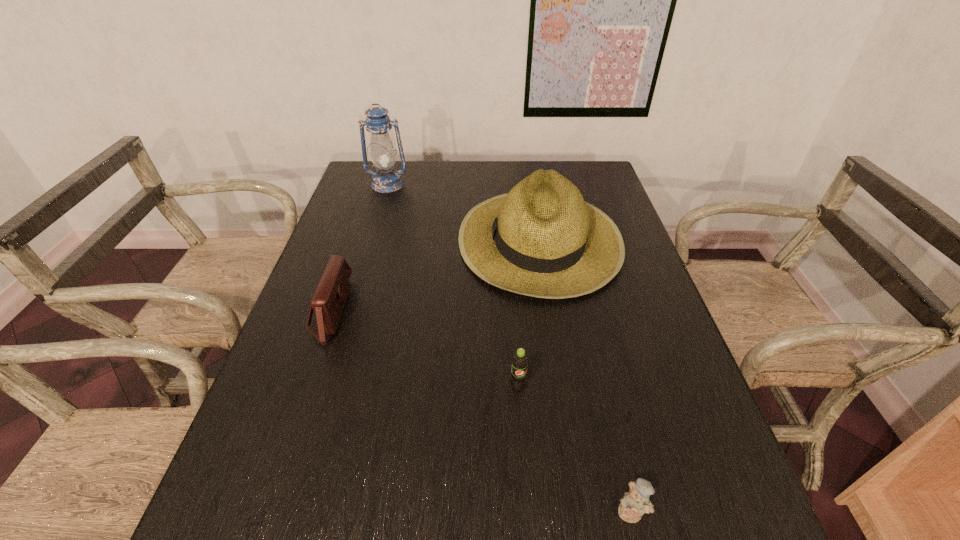
You are a GUI agent. You are given a task and a screenshot of the screen. Output one action in this format:
    pyautogui.click(x=<x>, y=<y>)
    Task: Click on the tallest object
    
    Given the screenshot: What is the action you would take?
    pyautogui.click(x=386, y=179)

Identify the location of sunhat. (542, 239).

You are a GUI agent. You are given a task and a screenshot of the screen. Output one action in this format:
    pyautogui.click(x=<x>, y=<y>)
    Task: Click on the fourth farthest object
    The image size is (960, 540).
    Given the screenshot: What is the action you would take?
    pyautogui.click(x=520, y=361)

The height and width of the screenshot is (540, 960). Find the location of `shoulder bag`. shoulder bag is located at coordinates (328, 302).

Identify the location of teddy bear. The image size is (960, 540). (635, 503).

The image size is (960, 540). Find the location of `the shortest object`. the shortest object is located at coordinates (635, 503).

Locate an element on the screen. free location located 0.200m on the front-facing side of the tallest object is located at coordinates (374, 227).

This screenshot has width=960, height=540. Identify the location of free space located 0.090m on the back of the second tallest object. (530, 179).

The width and height of the screenshot is (960, 540). Identify the location of blank area located on the front label of the soda. (519, 416).

Where is `vacant point located on the front flap of the shoulder bag`? This screenshot has height=540, width=960. vacant point located on the front flap of the shoulder bag is located at coordinates point(372,311).